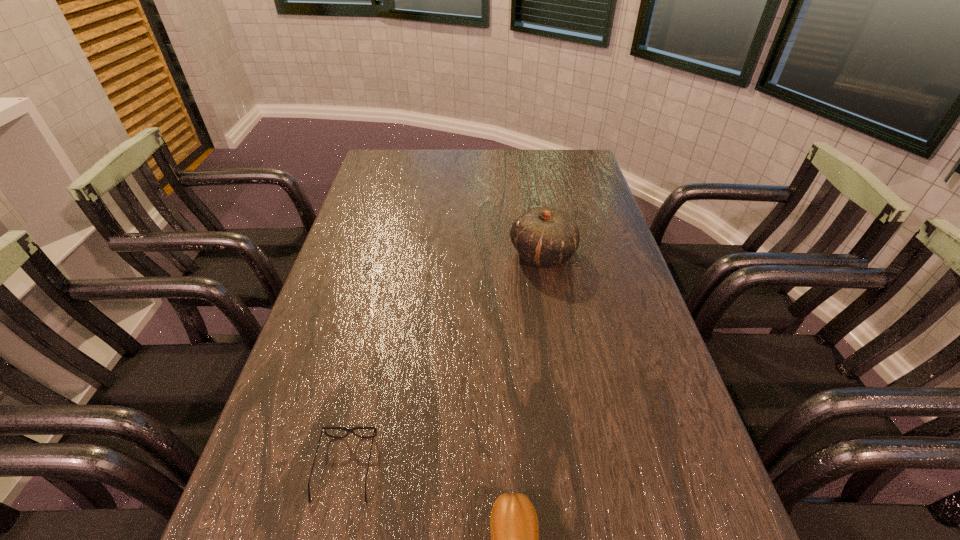
Image resolution: width=960 pixels, height=540 pixels. Identify the location of the farther gourd. (543, 236).

The image size is (960, 540). I want to click on the farthest object, so click(x=543, y=236).

The width and height of the screenshot is (960, 540). In order to click on the leftmost object in this screenshot , I will do `click(374, 429)`.

Find the location of `the shortest object`. the shortest object is located at coordinates (374, 429).

At what (x,y) coordinates should I click in order to perform the action: click on vacant area situated on the back of the taller gourd. Please return your answer as a coordinate pair (x, y). The width and height of the screenshot is (960, 540). Looking at the image, I should click on (530, 180).

The height and width of the screenshot is (540, 960). I want to click on object at the left edge, so click(x=374, y=429).

Where is `object that is at the right edge`? object that is at the right edge is located at coordinates (543, 236).

The image size is (960, 540). In order to click on vacant area at the far edge in this screenshot , I will do click(511, 150).

Image resolution: width=960 pixels, height=540 pixels. Find the location of `vacant position at the left edge of the desktop`. vacant position at the left edge of the desktop is located at coordinates click(386, 201).

The height and width of the screenshot is (540, 960). Identify the location of vacant region at the right edge. (655, 338).